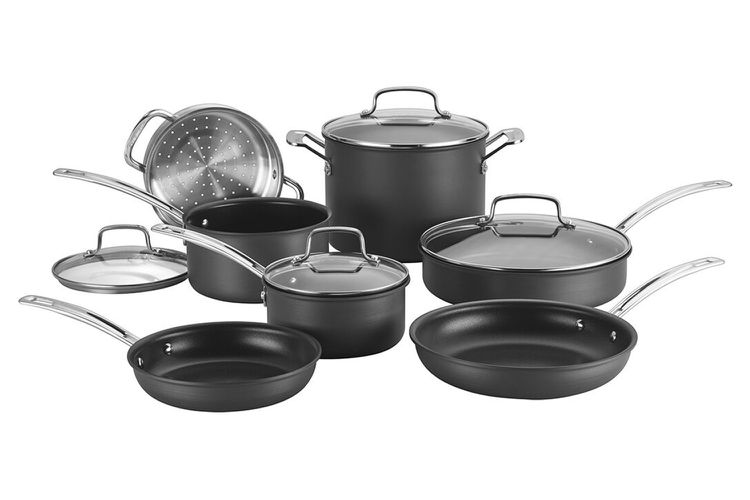
The width and height of the screenshot is (750, 500). In order to click on skillet in this screenshot , I will do `click(242, 357)`, `click(561, 358)`.